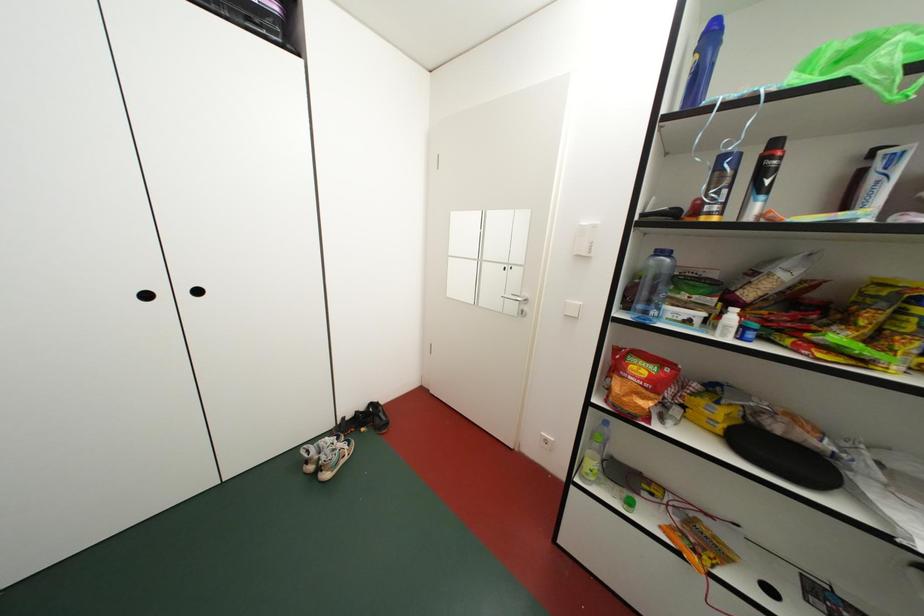
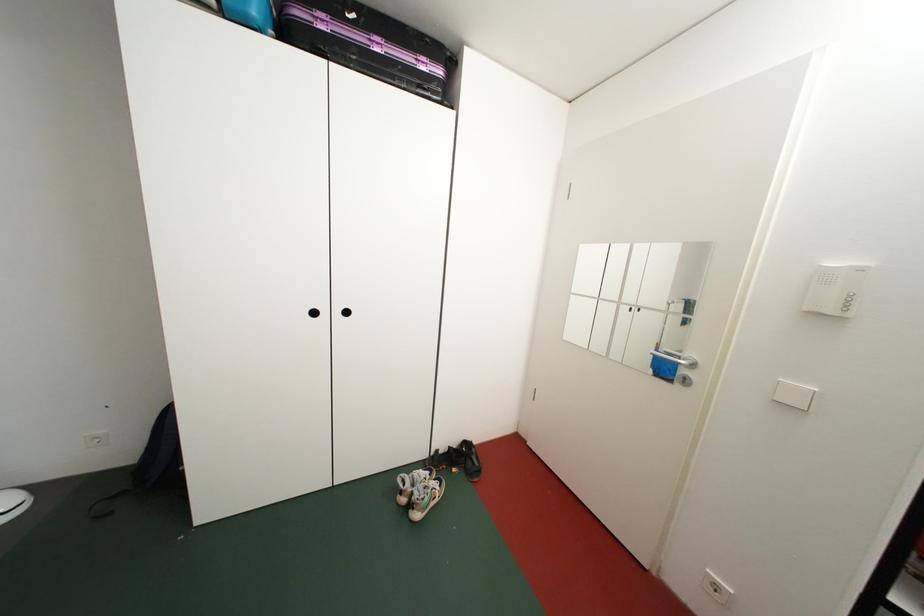
Question: The camera is either moving clockwise (left) or counter-clockwise (right) around the object. The first image is from the beginning of the video and the second image is from the end. Is the camera moving left or right when shooting the video?

Choices:
 (A) Left
 (B) Right

Answer: (B)